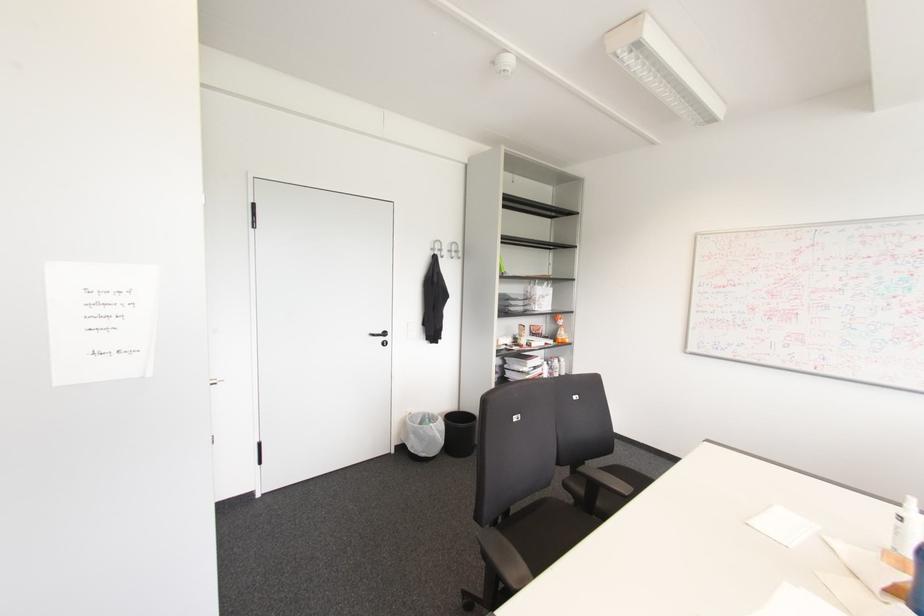
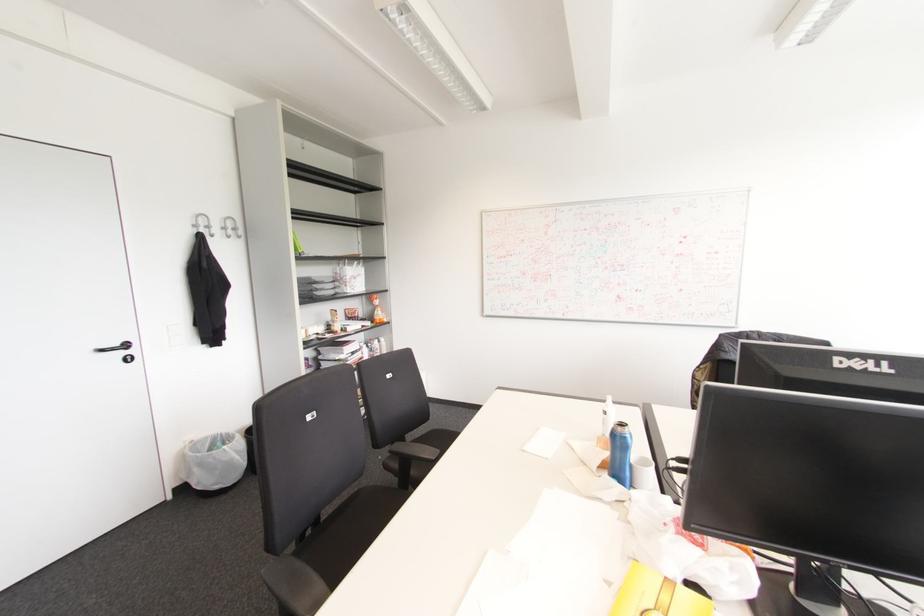
The point at (410, 436) is marked in the first image. Where is the corresponding point in the second image?

(195, 469)